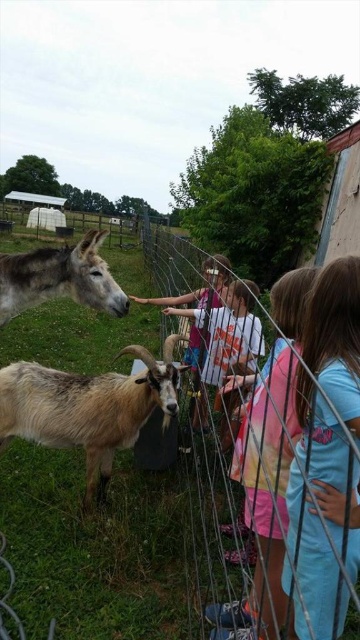
You are a child trying to see over the wire mesh fence at center to watch the goat and donkey. You are wearing a blue cotton shirt at right. Can you see over the fence if you stand on your tiptoes?

The wire mesh fence at center is taller than the blue cotton shirt at right, so even if you stand on your tiptoes, you might not be able to see over the fence since it is higher than the shirt.